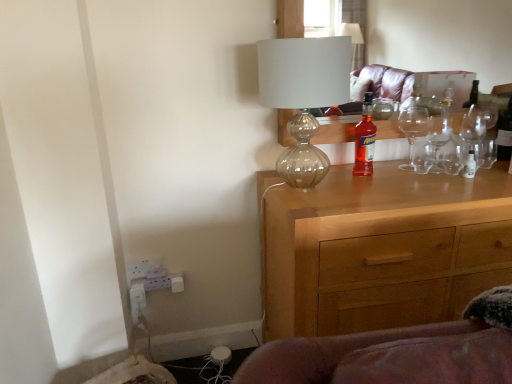
Find the location of `free region on the left part of clear glass bottle at upper right, which is the second bottle from front to back`. free region on the left part of clear glass bottle at upper right, which is the second bottle from front to back is located at coordinates (467, 161).